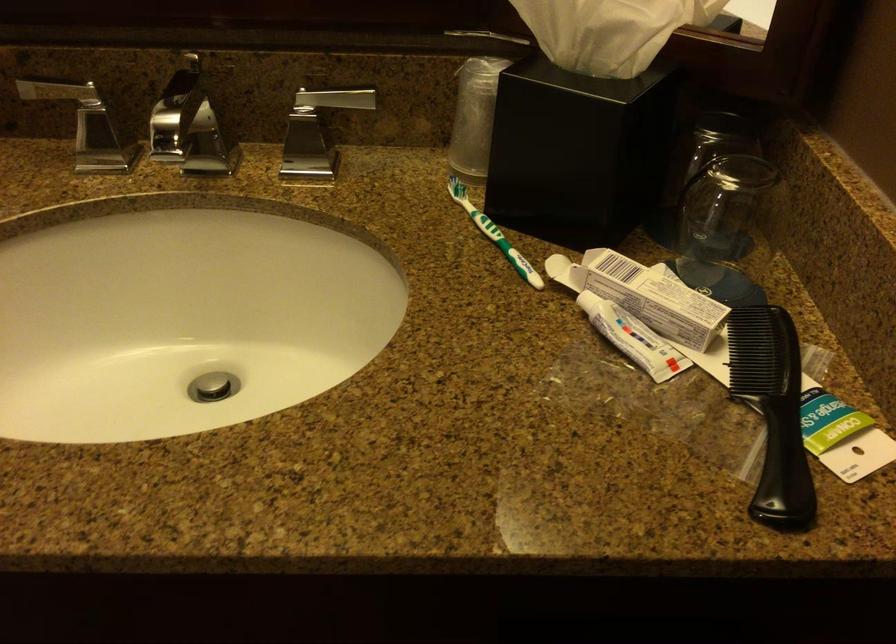
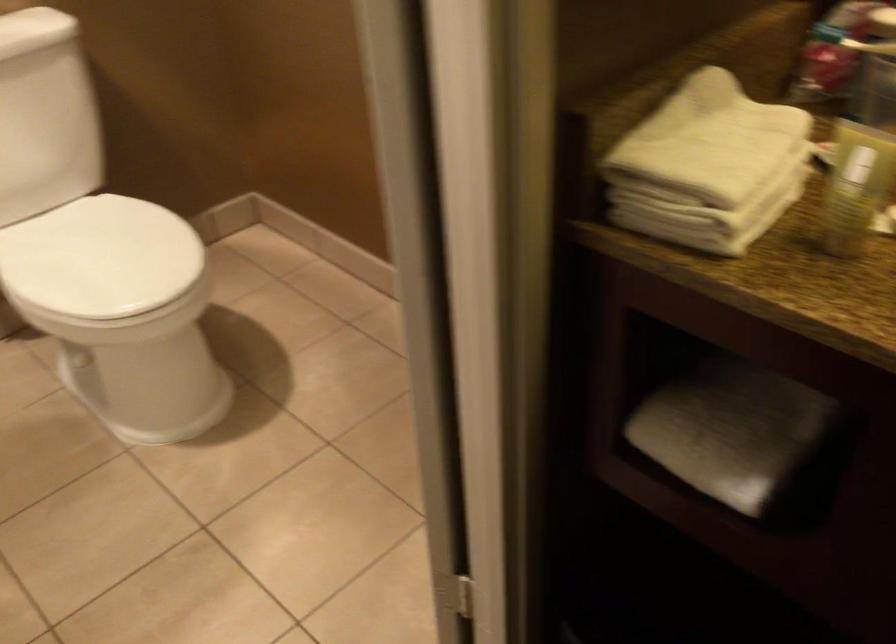
Question: The first image is from the beginning of the video and the second image is from the end. How did the camera likely rotate when shooting the video?

Choices:
 (A) Left
 (B) Right
 (C) Up
 (D) Down

Answer: (A)